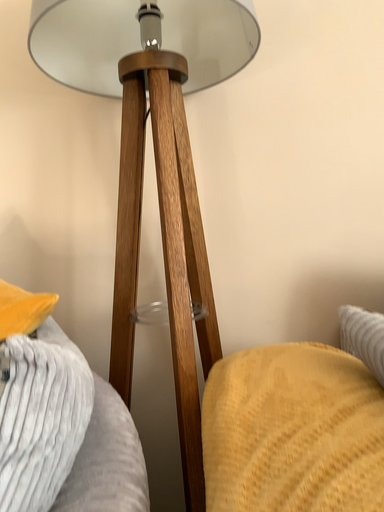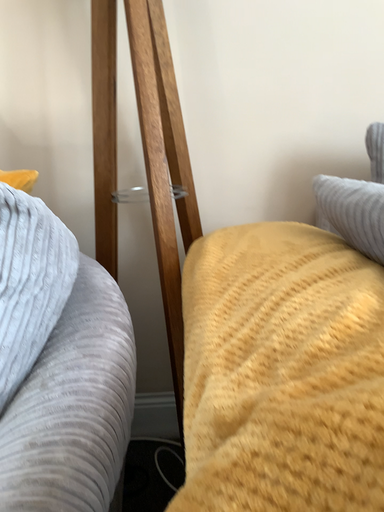
Question: Which way did the camera rotate in the video?

Choices:
 (A) rotated upward
 (B) rotated downward

Answer: (B)